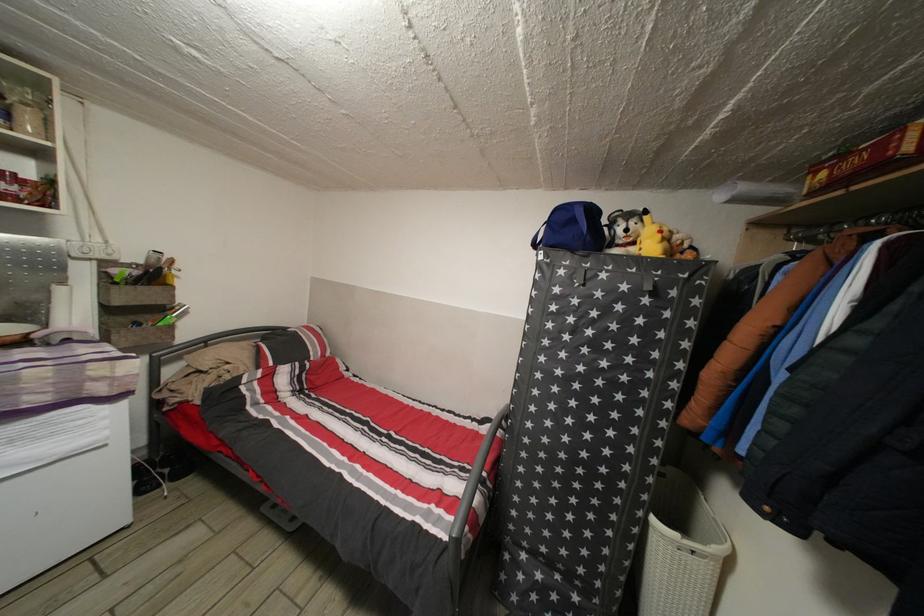
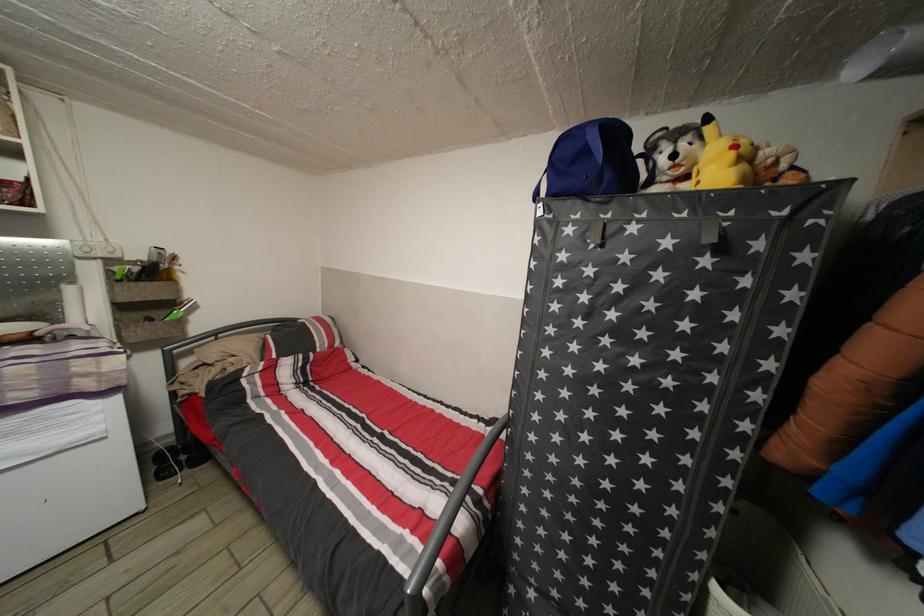
Where in the second image is the point corresponding to point (661, 525) from the first image?

(723, 594)